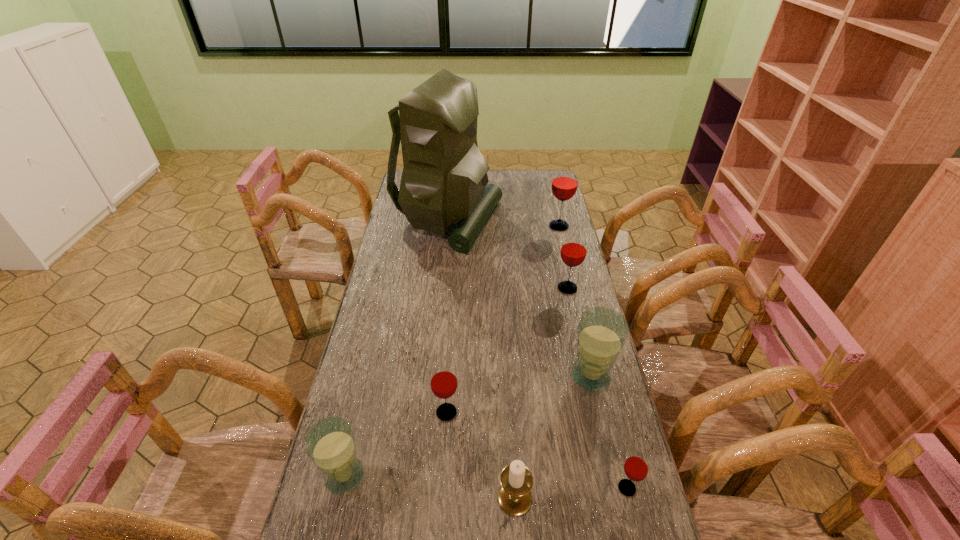
The height and width of the screenshot is (540, 960). I want to click on the smaller blue glass, so click(x=330, y=444).

Find the location of a particular element. The width and height of the screenshot is (960, 540). the nearer blue glass is located at coordinates (330, 444).

The height and width of the screenshot is (540, 960). Find the location of `candle holder`. candle holder is located at coordinates (514, 497).

Where is `the smallest red glass`? This screenshot has width=960, height=540. the smallest red glass is located at coordinates (636, 467).

You are a GUI agent. You are given a task and a screenshot of the screen. Output one action in this format:
    pyautogui.click(x=<x>, y=<y>)
    Task: Click on the shortest glass
    The width and height of the screenshot is (960, 540).
    Given the screenshot: What is the action you would take?
    pyautogui.click(x=636, y=467)

Locate an element on the screen. blank space located on the front of the tallest object with visible pockets is located at coordinates coord(559,221).

Find the location of `free location located on the front of the tallest glass`. free location located on the front of the tallest glass is located at coordinates 575,293.

Locate an element on the screen. This screenshot has height=540, width=960. free space located 0.300m on the back of the third nearest red glass is located at coordinates (555, 233).

You are a GUI agent. You are given a task and a screenshot of the screen. Output one action in this format:
    pyautogui.click(x=<x>, y=<y>)
    Task: Click on the free space located 0.250m on the left of the bigger blue glass
    Image resolution: width=960 pixels, height=540 pixels.
    Given the screenshot: What is the action you would take?
    pyautogui.click(x=484, y=376)

Where is `vacant space located on the right of the second nearest red glass`? The image size is (960, 540). vacant space located on the right of the second nearest red glass is located at coordinates (485, 413).